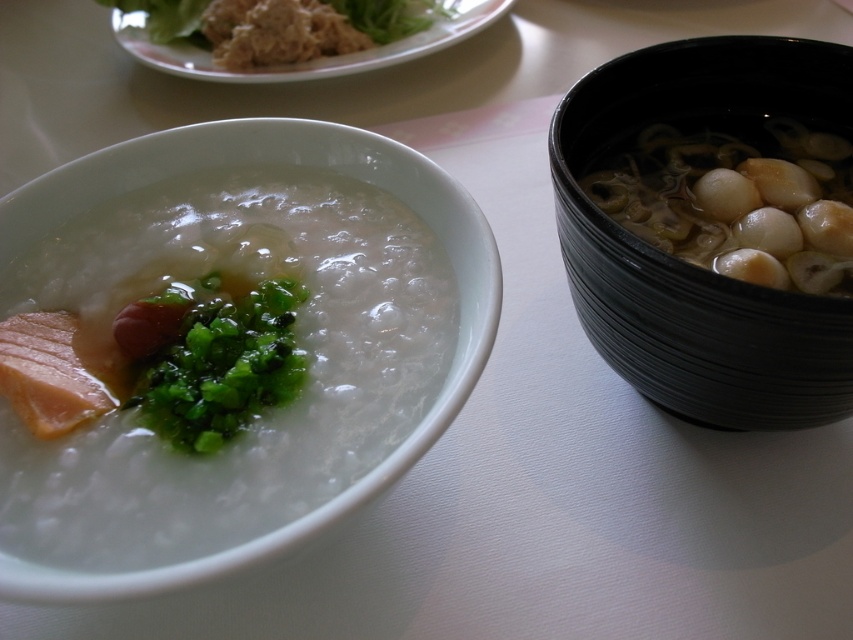
You are trying to reach a point that is exactly at the coordinates point (463, 369) on the table. If your hand is currently 60 centimeters away from the table, can you just move your hand forward a little bit to reach that point?

The distance of point (463, 369) from viewer is 54.81 centimeters. Since your hand is currently 60 centimeters away from the table, you can move your hand forward slightly to reach the point as it is closer than your current position.

You are at a restaurant and see two items on the table to your right. One is the black glossy bowl at right and the other is the white glossy ball at right. Which one is nearer to you?

The black glossy bowl at right is closer to the viewer than the white glossy ball at right, so the black glossy bowl at right is nearer to you.